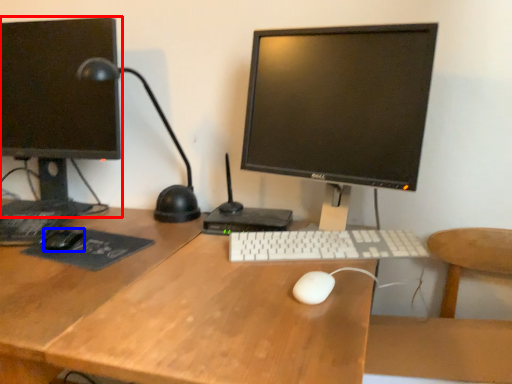
Question: Among these objects, which one is nearest to the camera, computer monitor (highlighted by a red box) or mouse (highlighted by a blue box)?

Choices:
 (A) computer monitor
 (B) mouse

Answer: (B)